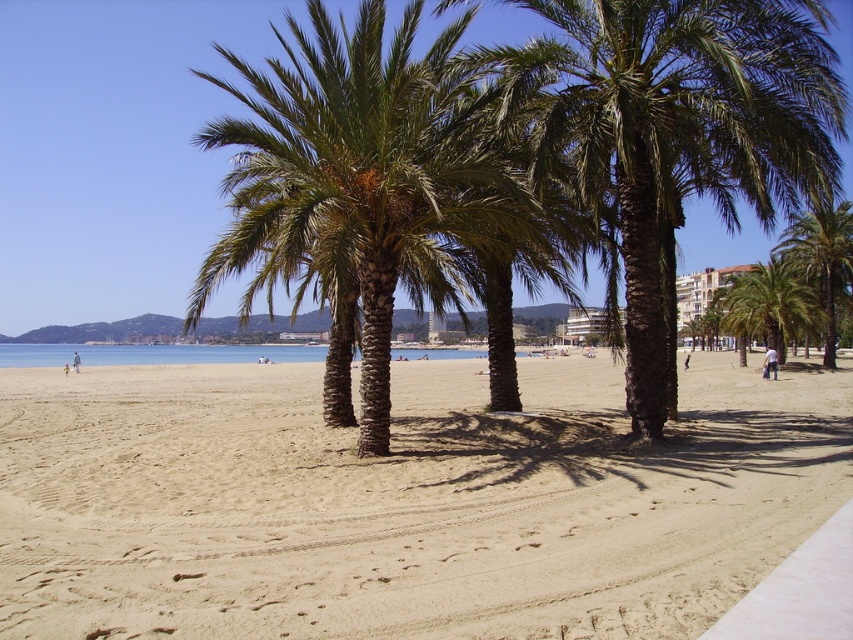
Who is lower down, beige sandy beach at center or green textured palm tree at right?

beige sandy beach at center is lower down.

Looking at this image, is beige sandy beach at center above green textured palm tree at right?

No, beige sandy beach at center is not above green textured palm tree at right.

Is point (59, 572) positioned in front of point (791, 321)?

Yes, point (59, 572) is in front of point (791, 321).

Find the location of a particular element. The image size is (853, 640). beige sandy beach at center is located at coordinates (403, 500).

Can you confirm if green textured palm tree at right is smaller than green leafy palm tree at right?

Correct, green textured palm tree at right occupies less space than green leafy palm tree at right.

Between green textured palm tree at right and green leafy palm tree at right, which one appears on the right side from the viewer's perspective?

Positioned to the right is green textured palm tree at right.

Locate an element on the screen. green textured palm tree at right is located at coordinates point(769,305).

This screenshot has width=853, height=640. Find the location of `green textured palm tree at right`. green textured palm tree at right is located at coordinates (769, 305).

Is point (331, 32) less distant than point (843, 243)?

Yes.

The height and width of the screenshot is (640, 853). I want to click on green-brown textured palm trees at center, so click(x=358, y=173).

Locate an element on the screen. The image size is (853, 640). green-brown textured palm trees at center is located at coordinates (358, 173).